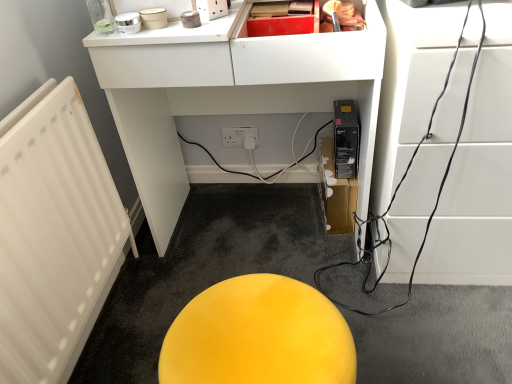
Question: Would you say yellow matte stool at center, which appears as the second furniture when viewed from the right, is part of matte black computer tower at lower center, the 3th furniture from the right,'s contents?

Choices:
 (A) yes
 (B) no

Answer: (B)

Question: Is matte black computer tower at lower center, the 3th furniture from the right, closer to the viewer compared to yellow matte stool at center, which appears as the second furniture when viewed from the right?

Choices:
 (A) no
 (B) yes

Answer: (A)

Question: Is matte black computer tower at lower center, which is the first furniture from left to right, oriented away from yellow matte stool at center, which is counted as the second furniture, starting from the left?

Choices:
 (A) no
 (B) yes

Answer: (A)

Question: From a real-world perspective, is matte black computer tower at lower center, the 3th furniture from the right, under yellow matte stool at center, which is counted as the second furniture, starting from the left?

Choices:
 (A) yes
 (B) no

Answer: (B)

Question: Would you say matte black computer tower at lower center, which is the first furniture from left to right, is outside yellow matte stool at center, which appears as the second furniture when viewed from the right?

Choices:
 (A) yes
 (B) no

Answer: (A)

Question: From the image's perspective, is black glossy cable at right, the 1th furniture positioned from the right, positioned above or below yellow matte stool at center, which is counted as the second furniture, starting from the left?

Choices:
 (A) below
 (B) above

Answer: (B)

Question: From a real-world perspective, is black glossy cable at right, which appears as the third furniture when viewed from the left, above or below yellow matte stool at center, which appears as the second furniture when viewed from the right?

Choices:
 (A) below
 (B) above

Answer: (B)

Question: Is black glossy cable at right, which appears as the third furniture when viewed from the left, situated inside yellow matte stool at center, which appears as the second furniture when viewed from the right, or outside?

Choices:
 (A) inside
 (B) outside

Answer: (B)

Question: Is point (426, 54) positioned closer to the camera than point (192, 344)?

Choices:
 (A) closer
 (B) farther

Answer: (B)

Question: Is matte black computer tower at lower center, the 3th furniture from the right, bigger or smaller than yellow matte stool at center, which is counted as the second furniture, starting from the left?

Choices:
 (A) big
 (B) small

Answer: (A)

Question: In terms of width, does matte black computer tower at lower center, which is the first furniture from left to right, look wider or thinner when compared to yellow matte stool at center, which appears as the second furniture when viewed from the right?

Choices:
 (A) wide
 (B) thin

Answer: (A)

Question: From their relative heights in the image, would you say matte black computer tower at lower center, the 3th furniture from the right, is taller or shorter than yellow matte stool at center, which is counted as the second furniture, starting from the left?

Choices:
 (A) short
 (B) tall

Answer: (B)

Question: Do you think matte black computer tower at lower center, the 3th furniture from the right, is within yellow matte stool at center, which is counted as the second furniture, starting from the left, or outside of it?

Choices:
 (A) inside
 (B) outside

Answer: (B)

Question: Visually, is black glossy cable at right, the 1th furniture positioned from the right, positioned to the left or to the right of matte black computer tower at lower center, which is the first furniture from left to right?

Choices:
 (A) left
 (B) right

Answer: (B)

Question: From a real-world perspective, is black glossy cable at right, the 1th furniture positioned from the right, physically located above or below matte black computer tower at lower center, the 3th furniture from the right?

Choices:
 (A) below
 (B) above

Answer: (A)